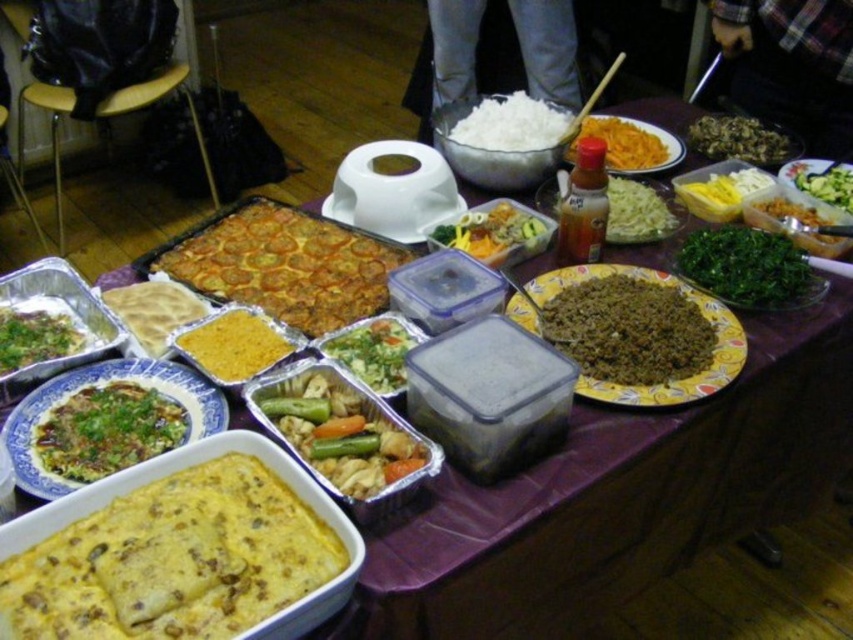
Question: Among these objects, which one is nearest to the camera?

Choices:
 (A) golden brown crispy pastry at center
 (B) yellow cheesy casserole at lower left
 (C) green leafy vegetables at lower left

Answer: (B)

Question: Is golden brown crispy pastry at center positioned in front of green leafy garnish on rice at lower left?

Choices:
 (A) yes
 (B) no

Answer: (B)

Question: Which object appears farthest from the camera in this image?

Choices:
 (A) green leafy garnish on rice at lower left
 (B) brown crumbly at center
 (C) green leafy vegetable at center
 (D) yellow matte flatbread at center-left

Answer: (C)

Question: Is the position of golden brown crispy pastry at center more distant than that of golden brown chicken at center?

Choices:
 (A) yes
 (B) no

Answer: (A)

Question: Which point is closer to the camera?

Choices:
 (A) green leafy vegetables at center
 (B) yellow creamy rice at center
 (C) green leafy garnish on rice at lower left
 (D) yellow translucent plastic container at upper right

Answer: (C)

Question: Does green leafy vegetable at right appear on the left side of green leafy vegetables at center?

Choices:
 (A) yes
 (B) no

Answer: (A)